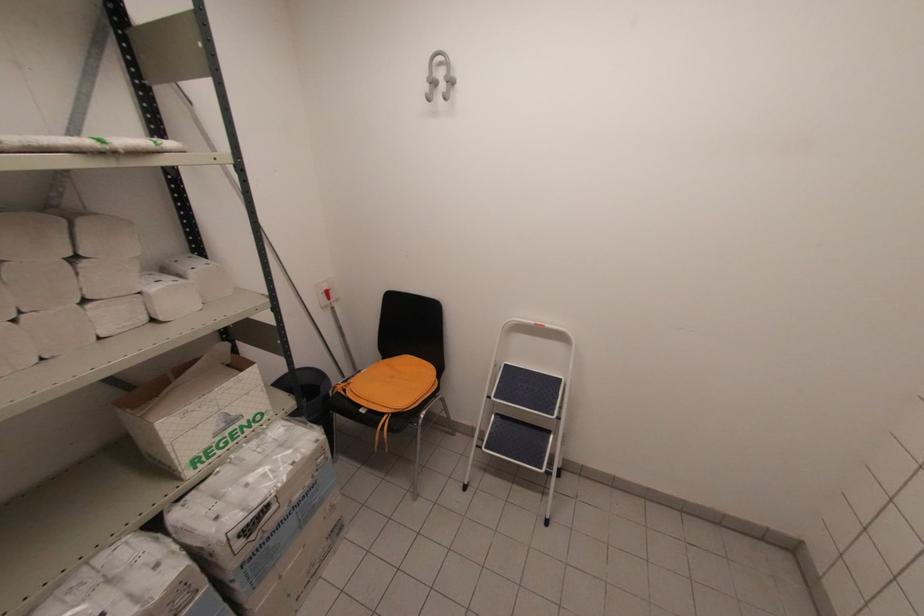
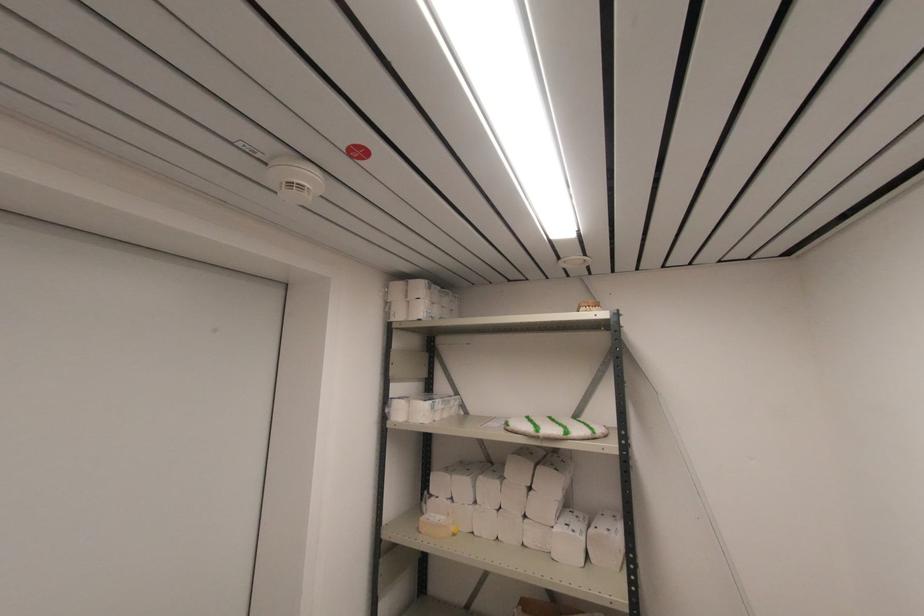
Locate, in the second image, the point that corresponds to point (107, 148) in the first image.

(537, 436)